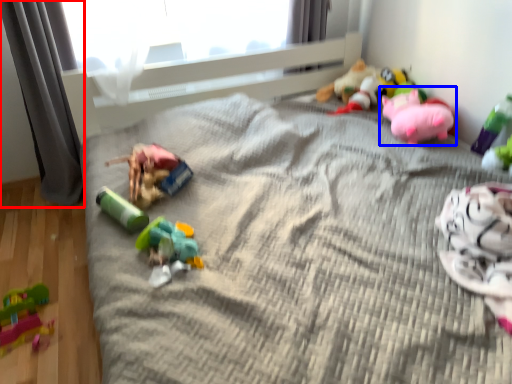
Question: Which object is further to the camera taking this photo, curtain (highlighted by a red box) or toy (highlighted by a blue box)?

Choices:
 (A) curtain
 (B) toy

Answer: (B)